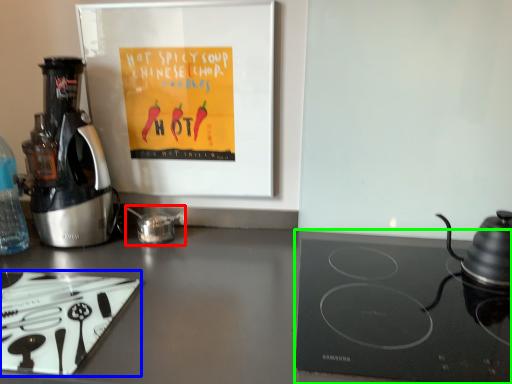
Question: Estimate the real-world distances between objects in this image. Which object is closer to tea pot (highlighted by a red box), kitchen appliance (highlighted by a blue box) or gas stove (highlighted by a green box)?

Choices:
 (A) kitchen appliance
 (B) gas stove

Answer: (A)